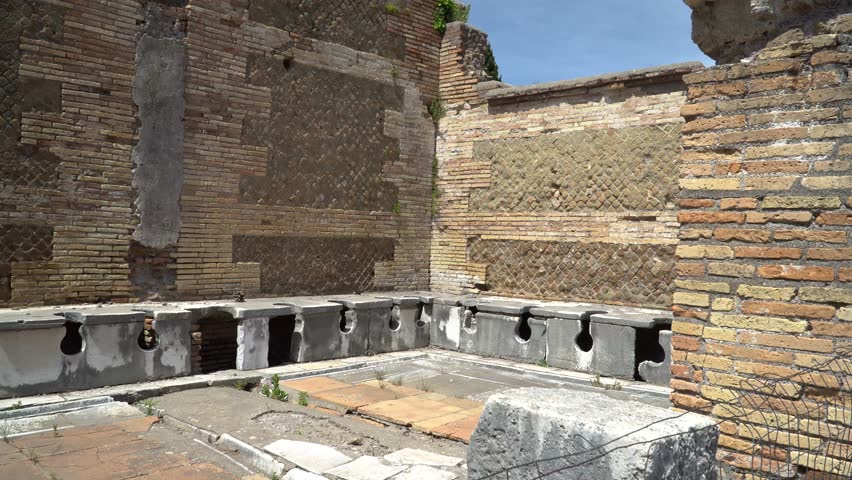
In order to click on plant in this screenshot , I will do `click(147, 408)`.